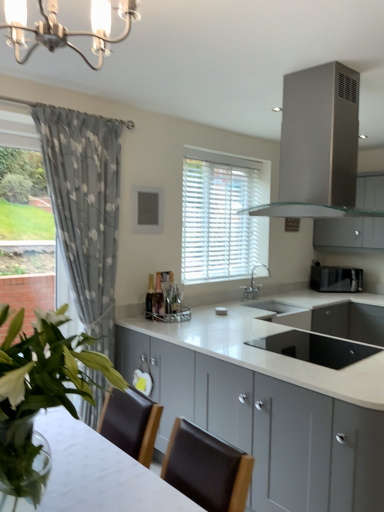
Question: Which is correct: white blinds at center is inside silver metallic faucet at center, or outside of it?

Choices:
 (A) inside
 (B) outside

Answer: (B)

Question: Considering their positions, is white blinds at center located in front of or behind silver metallic faucet at center?

Choices:
 (A) front
 (B) behind

Answer: (A)

Question: Which object is positioned farthest from the gray floral fabric curtain at left?

Choices:
 (A) green leafy plant at center
 (B) black glass sink at center, positioned as the 1th appliance in bottom-to-top order
 (C) white blinds at center
 (D) silver metallic faucet at center
 (E) satin silver cabinet at upper right, which is the 1th cabinetry in back-to-front order

Answer: (E)

Question: Estimate the real-world distances between objects in this image. Which object is farther from the metallic chandelier at upper center?

Choices:
 (A) silver metallic faucet at center
 (B) satin silver cabinet at upper right, which is the 1th cabinetry in back-to-front order
 (C) black glass sink at center, positioned as the 1th appliance in bottom-to-top order
 (D) black matte toaster at right, which is the 1th appliance from back to front
 (E) green leafy plant at center

Answer: (D)